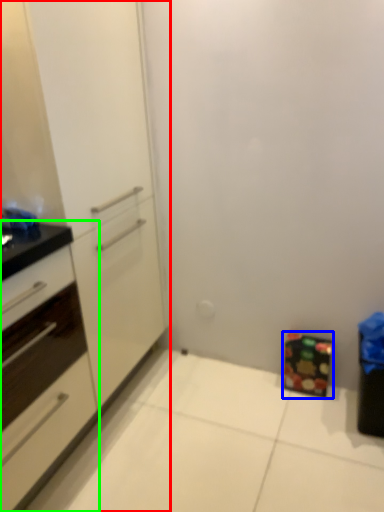
Question: Which object is positioned closest to cabinetry (highlighted by a red box)? Select from cabinetry (highlighted by a blue box) and cabinetry (highlighted by a green box).

Choices:
 (A) cabinetry
 (B) cabinetry

Answer: (B)